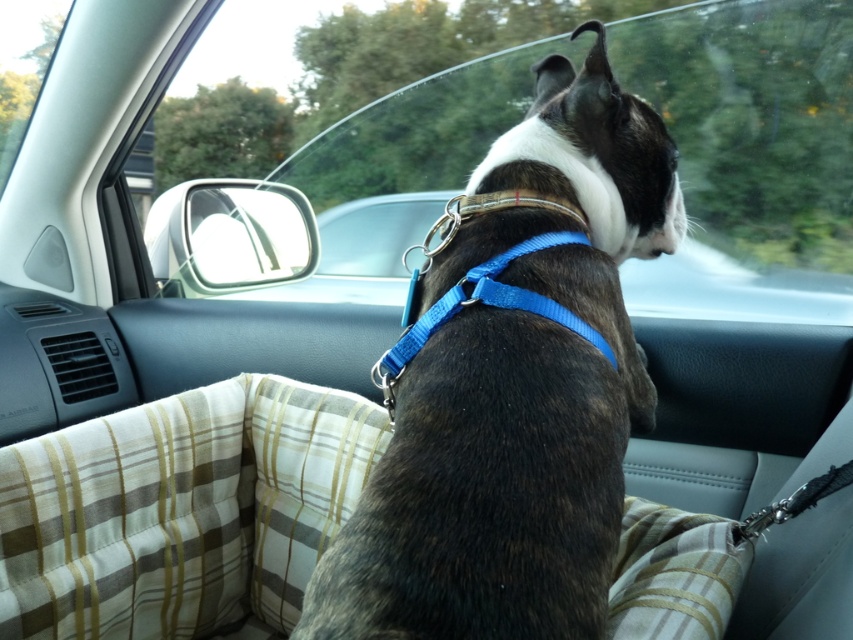
Consider the image. Is transparent glass car window at center taller than plaid fabric dog bed at center?

Correct, transparent glass car window at center is much taller as plaid fabric dog bed at center.

Image resolution: width=853 pixels, height=640 pixels. Find the location of `transparent glass car window at center`. transparent glass car window at center is located at coordinates (750, 156).

Where is `transparent glass car window at center`? The image size is (853, 640). transparent glass car window at center is located at coordinates (750, 156).

Is point (782, 32) less distant than point (490, 260)?

No, (782, 32) is further to viewer.

Between transparent glass car window at center and blue nylon neckband at center, which one has less height?

Standing shorter between the two is blue nylon neckband at center.

Is point (730, 157) behind point (558, 234)?

Yes, it is behind point (558, 234).

Where is `transparent glass car window at center`? This screenshot has height=640, width=853. transparent glass car window at center is located at coordinates (750, 156).

Between plaid fabric dog bed at center and blue nylon neckband at center, which one has more height?

With more height is plaid fabric dog bed at center.

Find the location of a particular element. Image resolution: width=853 pixels, height=640 pixels. plaid fabric dog bed at center is located at coordinates (180, 509).